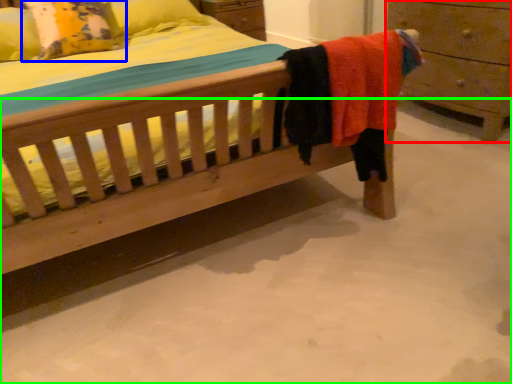
Question: Based on their relative distances, which object is nearer to chest of drawers (highlighted by a red box)? Choose from pillow (highlighted by a blue box) and concrete (highlighted by a green box).

Choices:
 (A) pillow
 (B) concrete

Answer: (B)